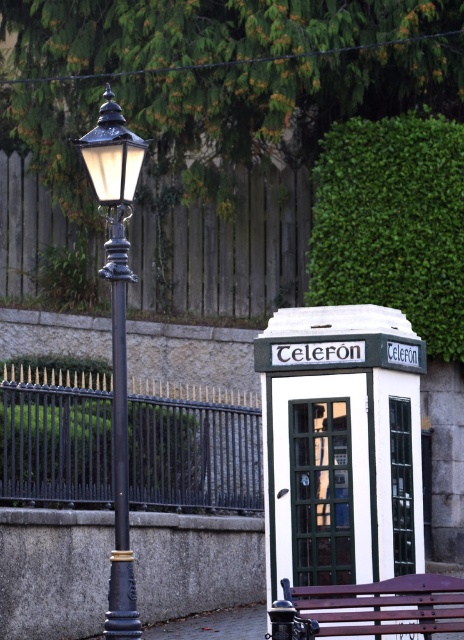
Is matte black lamp post at left thinner than wooden bench at lower center?

Correct, matte black lamp post at left's width is less than wooden bench at lower center's.

Can you confirm if matte black lamp post at left is positioned to the right of wooden bench at lower center?

Incorrect, matte black lamp post at left is not on the right side of wooden bench at lower center.

Locate an element on the screen. This screenshot has height=640, width=464. matte black lamp post at left is located at coordinates click(116, 332).

Is black metal fence at center to the right of brown wooden fence at upper center from the viewer's perspective?

In fact, black metal fence at center is to the left of brown wooden fence at upper center.

Does point (251, 472) come behind point (167, 257)?

No, it is in front of (167, 257).

Find the location of a particular element. The width and height of the screenshot is (464, 640). black metal fence at center is located at coordinates (x=193, y=448).

Is white painted metal telephone booth at center shorter than black polished metal pole at left?

No.

Who is taller, white painted metal telephone booth at center or black polished metal pole at left?

white painted metal telephone booth at center is taller.

Identify the location of white painted metal telephone booth at center. (341, 445).